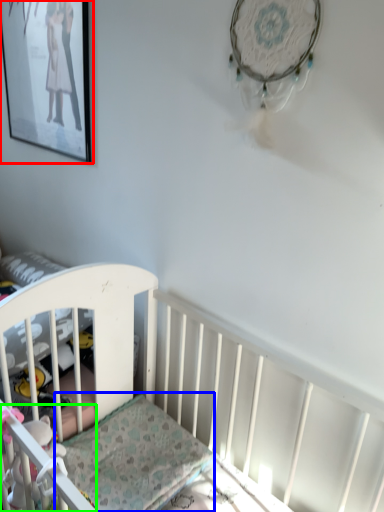
Question: Which object is the closest to the picture frame (highlighted by a red box)? Choose among these: mattress (highlighted by a blue box) or toy (highlighted by a green box).

Choices:
 (A) mattress
 (B) toy

Answer: (A)